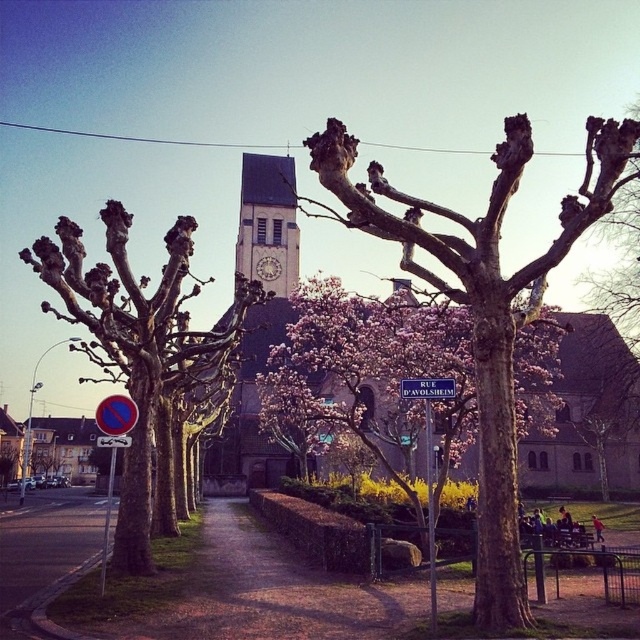
You are standing at the entrance of the church and want to take a photo of the bare wood tree at center. Based on its 2D location, where should you position yourself to capture it in the frame?

The bare wood tree at center is located at point 0.481 on the x axis and 0.756 on the y axis, so you should position yourself to the right of the entrance and slightly below the tree to capture it in the frame.